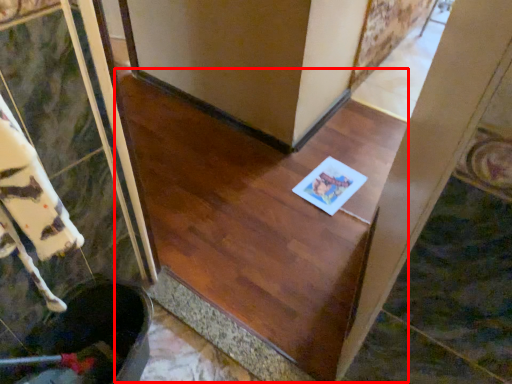
Question: Considering the relative positions of stairwell (annotated by the red box) and copy in the image provided, where is stairwell (annotated by the red box) located with respect to the staircase?

Choices:
 (A) left
 (B) right

Answer: (A)